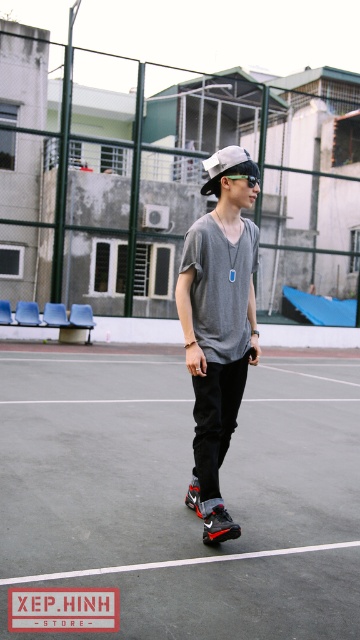
Question: Where is black rubber tennis court at center located in relation to white matte baseball cap at center in the image?

Choices:
 (A) right
 (B) left

Answer: (B)

Question: Can you confirm if matte gray t-shirt at center is smaller than white matte baseball cap at center?

Choices:
 (A) no
 (B) yes

Answer: (A)

Question: Which point is closer to the camera?

Choices:
 (A) white matte baseball cap at center
 (B) black rubber tennis court at center
 (C) matte gray t-shirt at center

Answer: (B)

Question: Among these points, which one is farthest from the camera?

Choices:
 (A) (225, 429)
 (B) (66, 481)

Answer: (B)

Question: Does black rubber tennis court at center have a larger size compared to white matte baseball cap at center?

Choices:
 (A) yes
 (B) no

Answer: (A)

Question: Based on their relative distances, which object is farther from the black rubber tennis court at center?

Choices:
 (A) white matte baseball cap at center
 (B) matte gray t-shirt at center

Answer: (A)